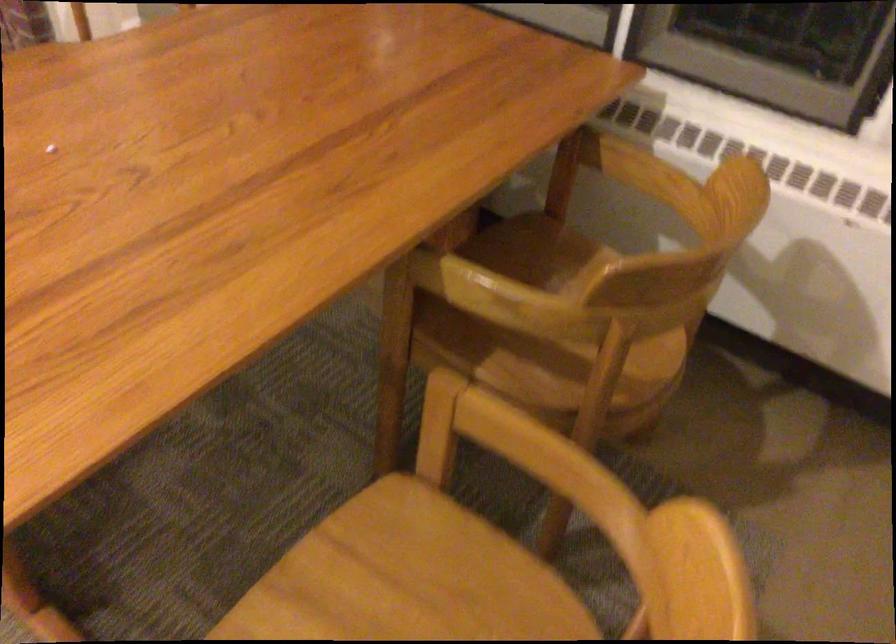
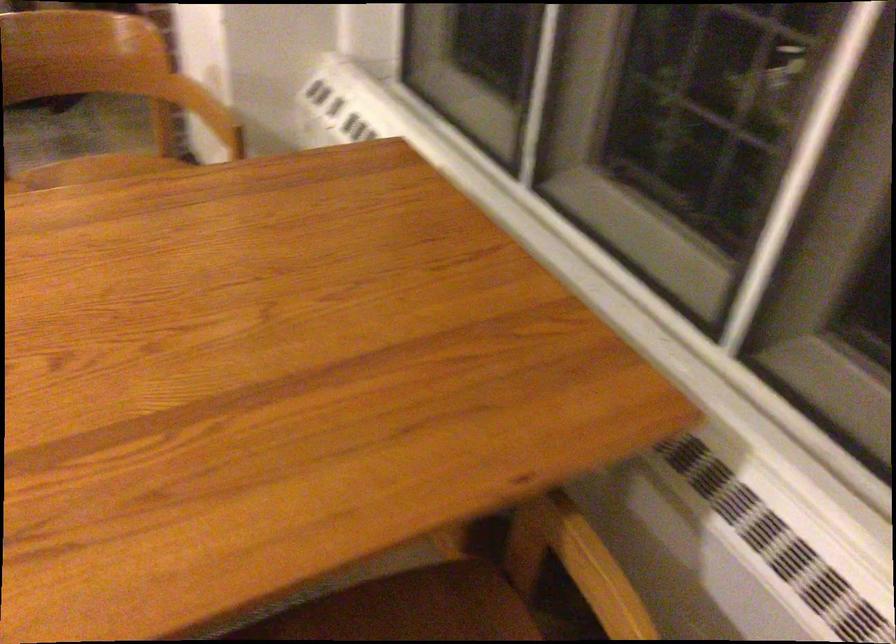
Question: Based on the continuous images, in which direction is the camera rotating? Reply with the corresponding letter.

Choices:
 (A) Left
 (B) Right
 (C) Up
 (D) Down

Answer: (A)